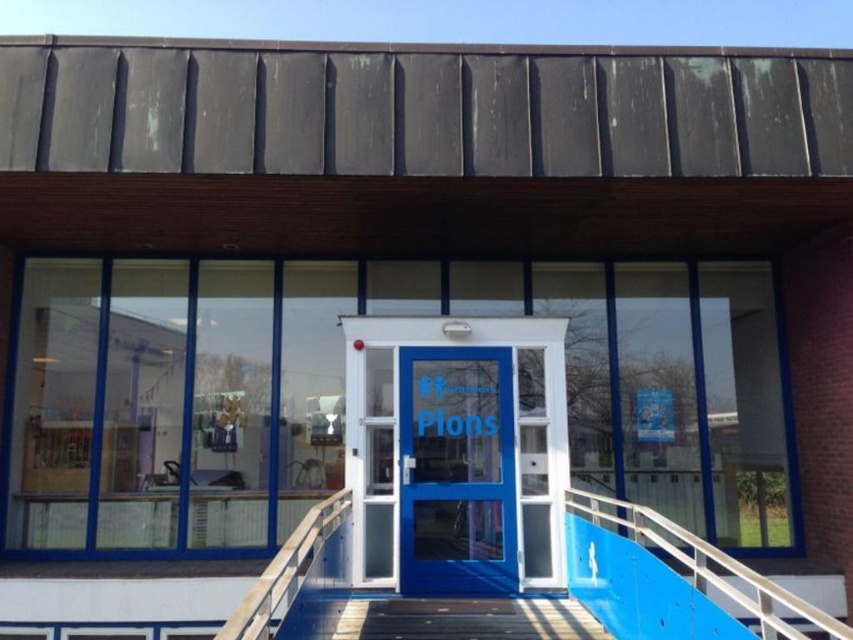
At what (x,y) coordinates should I click in order to perform the action: click on blue metallic handrail at lower right. Please return your answer as a coordinate pair (x, y). The height and width of the screenshot is (640, 853). Looking at the image, I should click on (714, 572).

Can you confirm if blue metallic handrail at lower right is thinner than white plastic rail at center?

In fact, blue metallic handrail at lower right might be wider than white plastic rail at center.

Which is in front, point (653, 532) or point (242, 620)?

Point (242, 620) is more forward.

In order to click on blue metallic handrail at lower right in this screenshot , I will do `click(714, 572)`.

Locate an element on the screen. This screenshot has width=853, height=640. blue glossy door at center is located at coordinates (456, 472).

Does blue glossy door at center have a smaller size compared to white plastic rail at center?

Actually, blue glossy door at center might be larger than white plastic rail at center.

Who is more forward, (x=495, y=348) or (x=270, y=614)?

Point (x=270, y=614)

At what (x,y) coordinates should I click in order to perform the action: click on blue glossy door at center. Please return your answer as a coordinate pair (x, y). Looking at the image, I should click on (456, 472).

Is blue glossy door at center above blue metallic handrail at lower right?

Correct, blue glossy door at center is located above blue metallic handrail at lower right.

Consider the image. Between blue glossy door at center and blue metallic handrail at lower right, which one has less height?

blue metallic handrail at lower right

Who is more forward, (x=469, y=384) or (x=764, y=604)?

Point (x=764, y=604) is in front.

The height and width of the screenshot is (640, 853). Find the location of `blue glossy door at center`. blue glossy door at center is located at coordinates (456, 472).